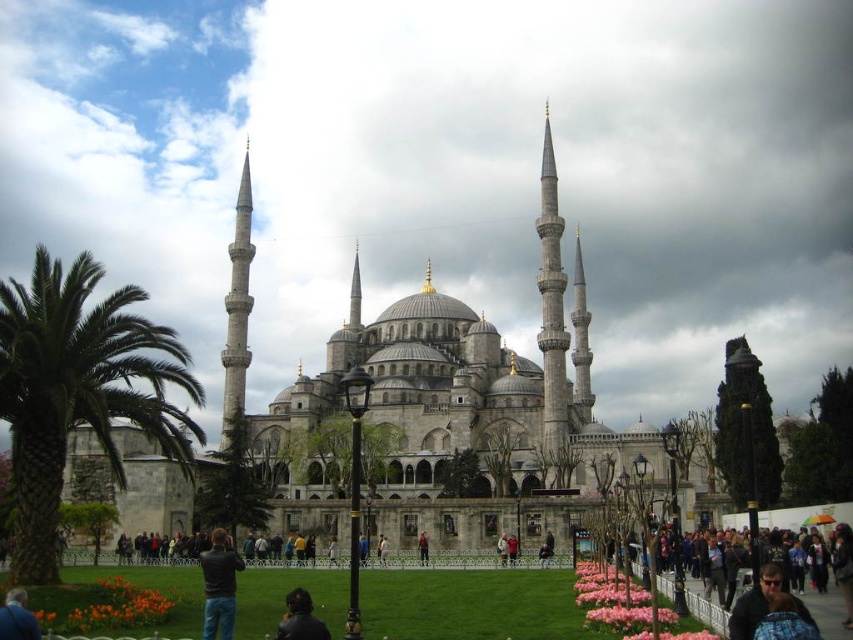
Between point (112, 449) and point (311, 632), which one is positioned behind?

Positioned behind is point (112, 449).

Can you confirm if green leafy palm tree at left is positioned to the left of dark brown leather jacket at lower center?

Indeed, green leafy palm tree at left is positioned on the left side of dark brown leather jacket at lower center.

You are a GUI agent. You are given a task and a screenshot of the screen. Output one action in this format:
    pyautogui.click(x=<x>, y=<y>)
    Task: Click on the green leafy palm tree at left
    
    Given the screenshot: What is the action you would take?
    pyautogui.click(x=78, y=392)

What do you see at coordinates (16, 618) in the screenshot? The image size is (853, 640). I see `dark blue jacket at lower left` at bounding box center [16, 618].

Between dark blue jacket at lower left and dark blue jeans at center, which one has more height?

Standing taller between the two is dark blue jacket at lower left.

This screenshot has height=640, width=853. In order to click on dark blue jacket at lower left in this screenshot , I will do `click(16, 618)`.

At what (x,y) coordinates should I click in order to perform the action: click on dark blue jacket at lower left. Please return your answer as a coordinate pair (x, y). The height and width of the screenshot is (640, 853). Looking at the image, I should click on (16, 618).

Is green leafy palm tree at left wider than dark blue jeans at lower left?

Correct, the width of green leafy palm tree at left exceeds that of dark blue jeans at lower left.

Locate an element on the screen. Image resolution: width=853 pixels, height=640 pixels. green leafy palm tree at left is located at coordinates (78, 392).